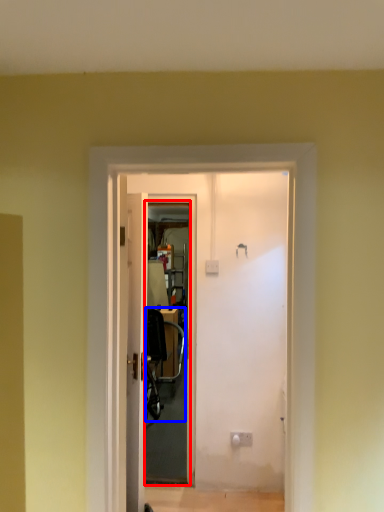
Question: Which of the following is the farthest to the observer, screen door (highlighted by a red box) or chair (highlighted by a blue box)?

Choices:
 (A) screen door
 (B) chair

Answer: (B)